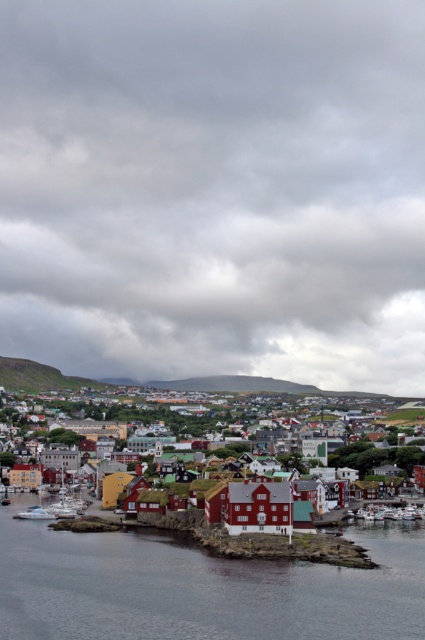
Question: Does smooth water at lower center appear on the left side of reddish-brown wooden houses at center?

Choices:
 (A) yes
 (B) no

Answer: (A)

Question: Which point appears closest to the camera in this image?

Choices:
 (A) (42, 364)
 (B) (201, 582)
 (C) (357, 454)

Answer: (B)

Question: Does smooth water at lower center appear over green grassy hillside at upper left?

Choices:
 (A) yes
 (B) no

Answer: (B)

Question: Among these objects, which one is farthest from the camera?

Choices:
 (A) reddish-brown wooden houses at center
 (B) green grassy hillside at upper left
 (C) smooth water at lower center

Answer: (B)

Question: Among these points, which one is nearest to the camera?

Choices:
 (A) (181, 632)
 (B) (345, 452)
 (C) (39, 376)

Answer: (A)

Question: Can you confirm if green grassy hillside at upper left is positioned below reddish-brown wooden houses at center?

Choices:
 (A) yes
 (B) no

Answer: (B)